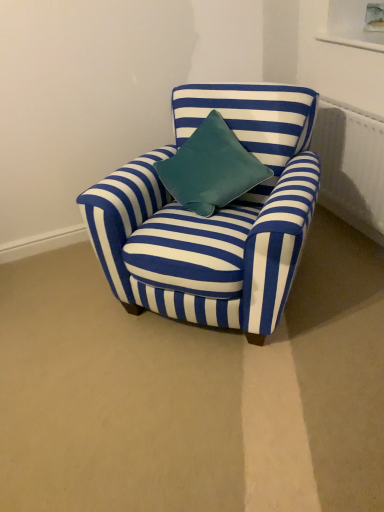
Question: Relative to blue striped fabric chair at center, is white textured radiator at upper right in front or behind?

Choices:
 (A) behind
 (B) front

Answer: (A)

Question: From the image's perspective, is white textured radiator at upper right located above or below blue striped fabric chair at center?

Choices:
 (A) below
 (B) above

Answer: (B)

Question: Considering the relative positions of white textured radiator at upper right and blue striped fabric chair at center in the image provided, is white textured radiator at upper right to the left or to the right of blue striped fabric chair at center?

Choices:
 (A) left
 (B) right

Answer: (B)

Question: From the image's perspective, is blue striped fabric chair at center positioned above or below white textured radiator at upper right?

Choices:
 (A) below
 (B) above

Answer: (A)

Question: From a real-world perspective, relative to white textured radiator at upper right, is blue striped fabric chair at center vertically above or below?

Choices:
 (A) above
 (B) below

Answer: (A)

Question: Considering the positions of blue striped fabric chair at center and white textured radiator at upper right in the image, is blue striped fabric chair at center taller or shorter than white textured radiator at upper right?

Choices:
 (A) tall
 (B) short

Answer: (A)

Question: Does point (102, 215) appear closer or farther from the camera than point (339, 205)?

Choices:
 (A) closer
 (B) farther

Answer: (A)